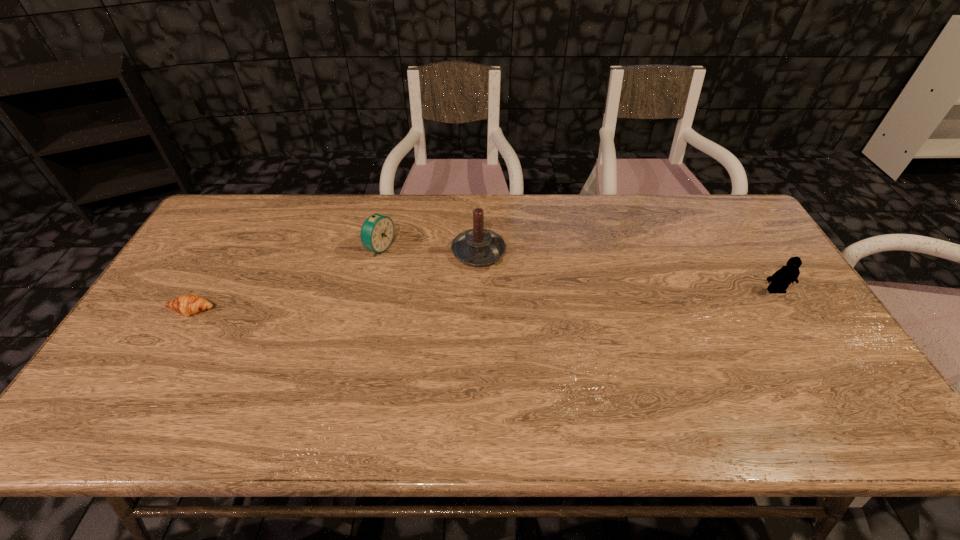
Locate an element on the screen. The width and height of the screenshot is (960, 540). free space located on the side of the second object from right to left with the handle loop is located at coordinates (563, 344).

At what (x,y) coordinates should I click in order to perform the action: click on vacant area situated 0.080m on the side of the second object from right to left with the handle loop. Please return your answer as a coordinate pair (x, y). Looking at the image, I should click on (509, 286).

You are a GUI agent. You are given a task and a screenshot of the screen. Output one action in this format:
    pyautogui.click(x=<x>, y=<y>)
    Task: Click on the blank space located on the front-facing side of the third object from right to left
    
    Given the screenshot: What is the action you would take?
    pyautogui.click(x=468, y=284)

Identify the location of vacant space located 0.210m on the front-facing side of the third object from right to left. (450, 277).

I want to click on blank area located 0.290m on the front-facing side of the third object from right to left, so click(474, 286).

This screenshot has width=960, height=540. Find the location of `candle situated at the far edge`. candle situated at the far edge is located at coordinates (476, 247).

Identify the location of alarm clock located at the far edge. (377, 232).

Find the location of a particular element. object that is at the left edge is located at coordinates (189, 304).

The width and height of the screenshot is (960, 540). What are the coordinates of `object that is at the right edge` in the screenshot? It's located at (780, 280).

Where is `vacant position at the far edge of the desktop`? Image resolution: width=960 pixels, height=540 pixels. vacant position at the far edge of the desktop is located at coordinates (446, 212).